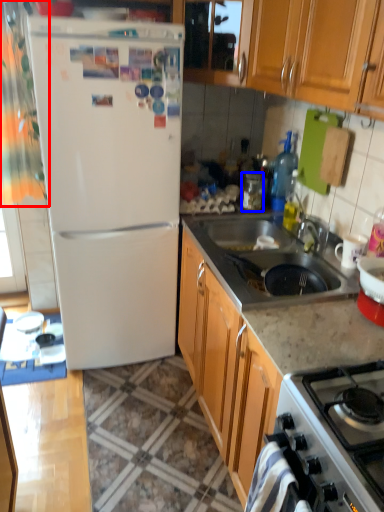
Question: Among these objects, which one is nearest to the camera, curtain (highlighted by a red box) or appliance (highlighted by a blue box)?

Choices:
 (A) curtain
 (B) appliance

Answer: (A)